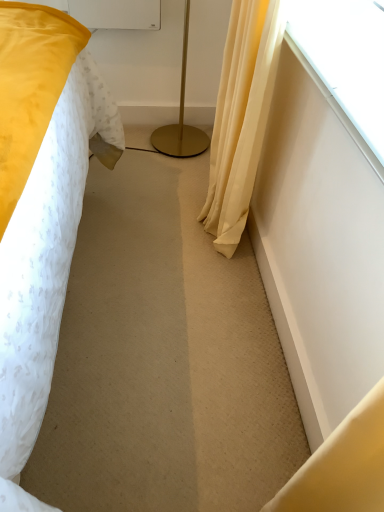
What are the coordinates of `empty space that is in between gold metallic floor lamp at center and silky yellow curtain at right` in the screenshot? It's located at point(180,189).